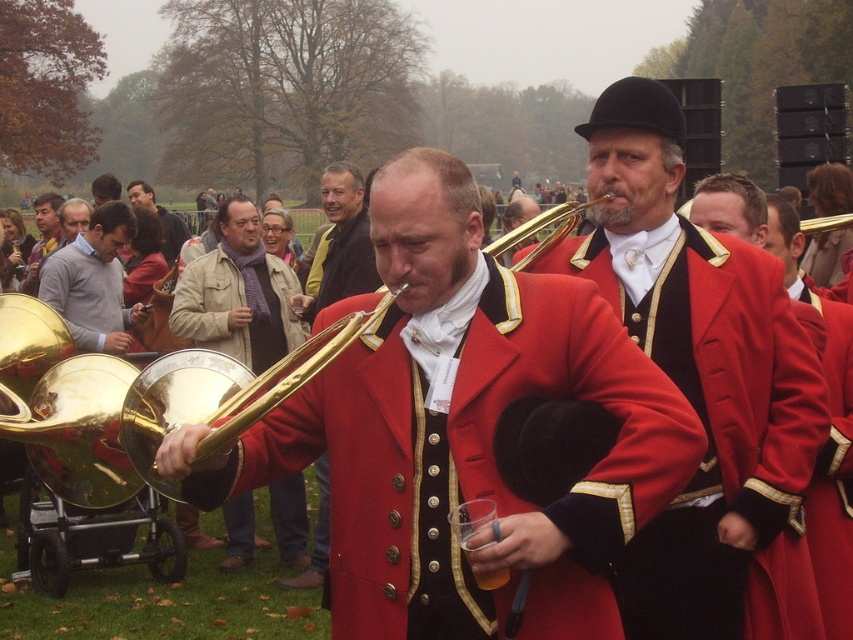
You are a photographer trying to capture a clear photo of the gold brass trumpet at center and the light gray sweater at center. Which object should you focus on first to ensure it appears sharp in the foreground?

The gold brass trumpet at center is in front of the light gray sweater at center. You should focus on the gold brass trumpet at center first to ensure it appears sharp in the foreground.

You are a stagehand who needs to move a 5.5 meter long ladder from the gold brass trumpet at center to the light gray sweater at center. Can you safely move the ladder without tilting it?

The distance between the gold brass trumpet at center and the light gray sweater at center is 5.32 meters. Since the ladder is 5.5 meters long, it would be too long to move horizontally between them without tilting it. Therefore, you cannot safely move the ladder without tilting it.